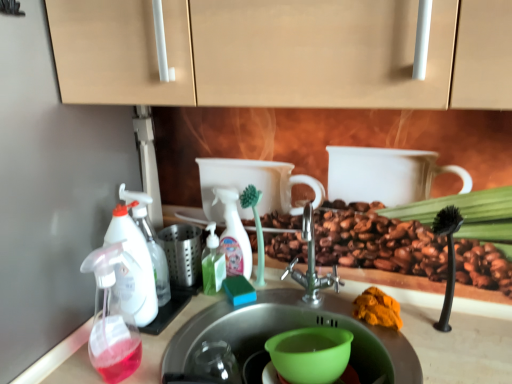
You are a GUI agent. You are given a task and a screenshot of the screen. Output one action in this format:
    pyautogui.click(x=<x>, y=<y>)
    Task: Click on the free space in front of translucent plastic soap dispenser at left, which ranks as the second soap dispenser in back-to-front order
    
    Given the screenshot: What is the action you would take?
    pyautogui.click(x=109, y=366)